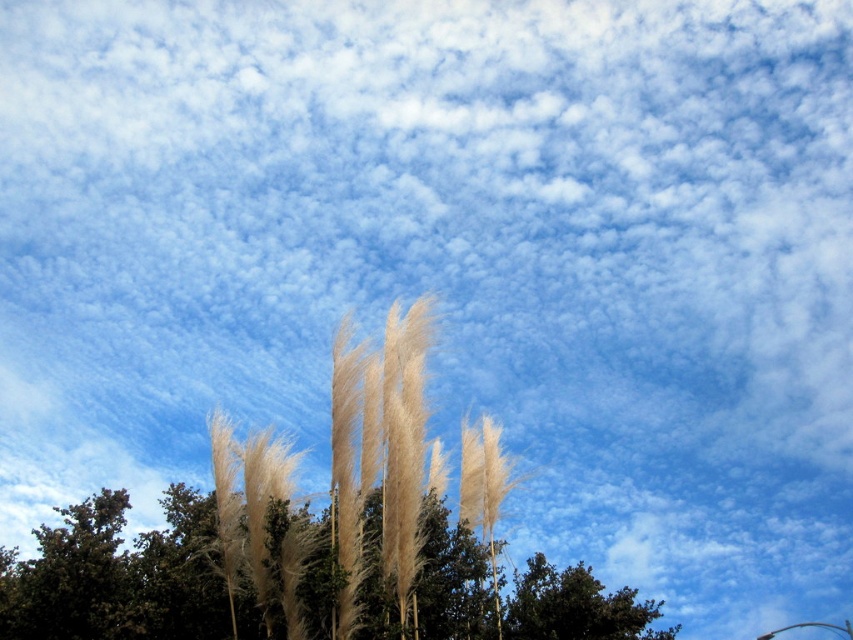
You are standing in the field and want to locate the silvery grass at center. According to the coordinates provided, where should you look relative to the image?

The silvery grass at center is located at coordinates point [119,573], which means it is positioned near the lower right corner of the image.

You are standing in a field and want to take a photo of the silvery grass at center and the dark green leafy tree at lower center. Which object should you focus on first if you want both to be in sharp focus?

The silvery grass at center is taller than the dark green leafy tree at lower center. To have both in sharp focus, you should focus on the dark green leafy tree at lower center because it is closer to you.

You are a gardener planning to plant a new row of plants in the garden. You have the silvery grass at center and the dark green leafy tree at lower center. Which plant should you choose if you want a wider spread in your garden?

The silvery grass at center might be wider than the dark green leafy tree at lower center, so it would be a better choice for a wider spread in the garden.